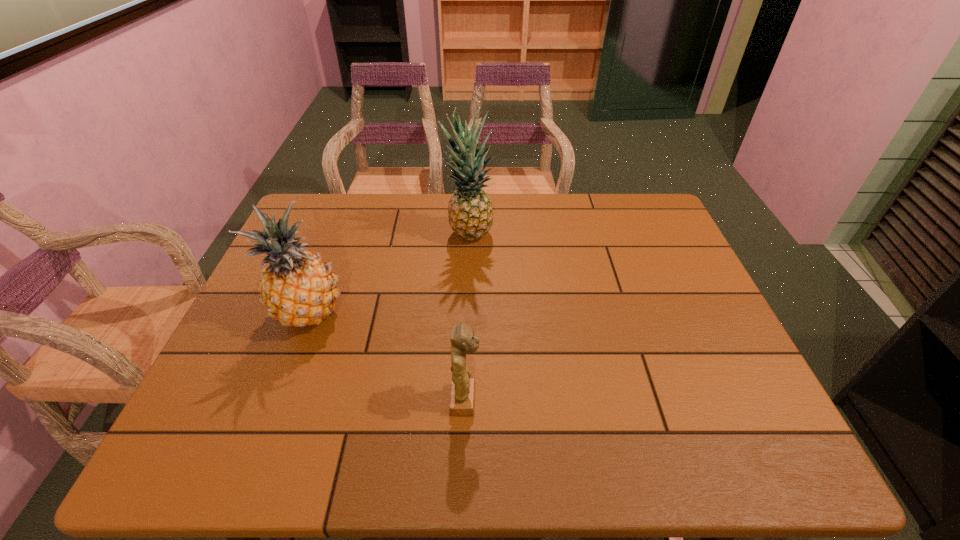
The height and width of the screenshot is (540, 960). I want to click on object that is at the left edge, so click(298, 288).

The image size is (960, 540). In the image, there is a desktop. Find the location of `free space at the far edge`. free space at the far edge is located at coordinates click(x=616, y=226).

The width and height of the screenshot is (960, 540). What are the coordinates of `free location at the near edge of the desktop` in the screenshot? It's located at (436, 435).

Locate an element on the screen. The height and width of the screenshot is (540, 960). free spot at the right edge of the desktop is located at coordinates [x=687, y=378].

I want to click on free point at the far right corner, so click(x=631, y=212).

Find the location of a particular element. vacant space that's between the leftmost object and the right pineapple is located at coordinates (388, 274).

This screenshot has height=540, width=960. I want to click on vacant space that's between the farthest object and the second nearest object, so click(388, 274).

In order to click on empty space that is in between the leftmost object and the tallest object in this screenshot , I will do `click(388, 274)`.

Identify the location of free area in between the tallest object and the figurine. (467, 318).

In order to click on free space between the nearest object and the tallest object in this screenshot , I will do `click(467, 318)`.